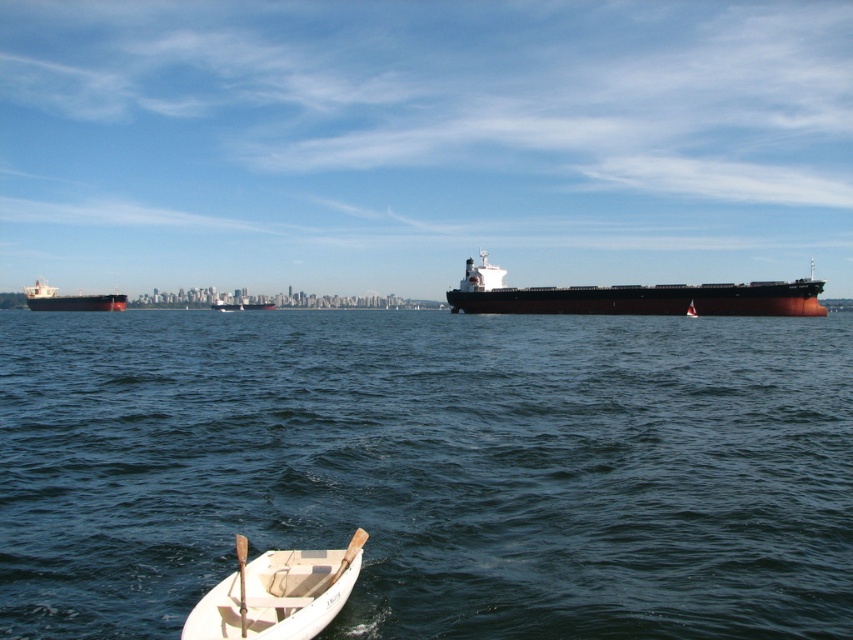
You are standing on the deck of the ship and want to determine the distance between two points marked on your navigation chart. The first point is labeled as point (230, 595) and the second is point (242, 545). According to the scene description, which point is closer to you?

Point (230, 595) is closer to you than point (242, 545) because it is further to the viewer in the scene.

You are standing on the dock and see the dark blue water at center and the wooden paddle at lower center. Which object is wider?

The dark blue water at center is wider than the wooden paddle at lower center.

You are an observer standing on the shore looking at the scene. You notice the dark blue water at center and the wooden paddle at lower center. Which object takes up more space in the image?

The dark blue water at center takes up more space in the image because it is larger in size than the wooden paddle at lower center.